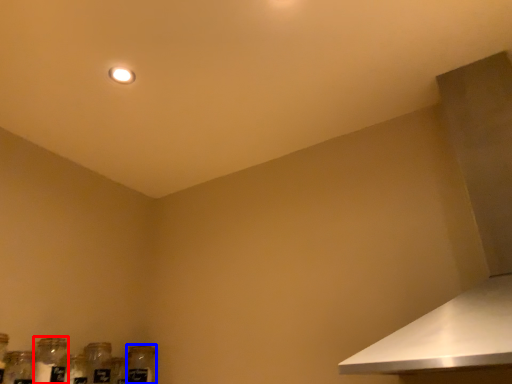
Question: Which object is closer to the camera taking this photo, bottle (highlighted by a red box) or glass bottle (highlighted by a blue box)?

Choices:
 (A) bottle
 (B) glass bottle

Answer: (A)